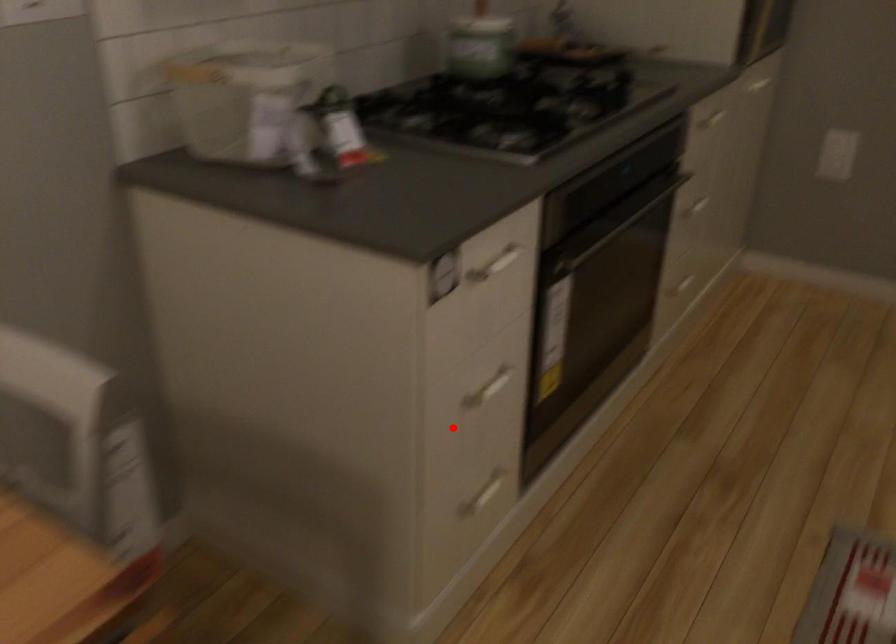
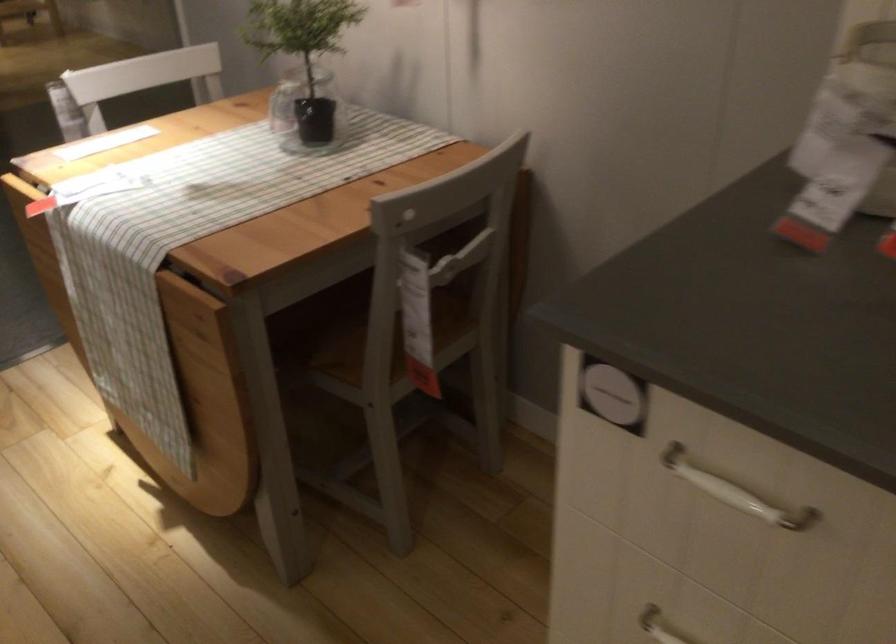
Question: I am providing you with two images of the same scene from different viewpoints. In image1, a red point is highlighted. Considering the same 3D point in image2, which of the following is correct?

Choices:
 (A) It is closer
 (B) It is farther

Answer: (A)